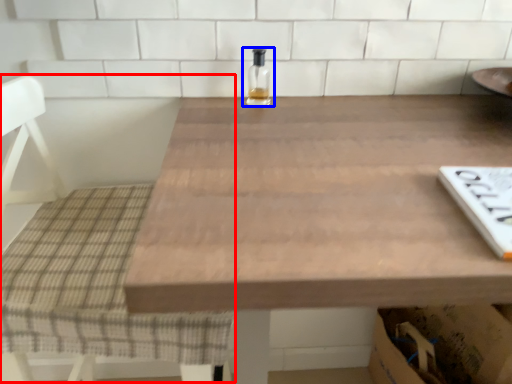
Question: Among these objects, which one is nearest to the camera, chair (highlighted by a red box) or bottle (highlighted by a blue box)?

Choices:
 (A) chair
 (B) bottle

Answer: (A)